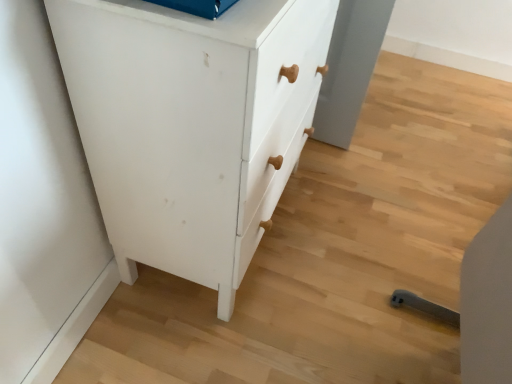
What are the coordinates of `vacant area that is situated to the right of white matte cabinet at center` in the screenshot? It's located at (364, 221).